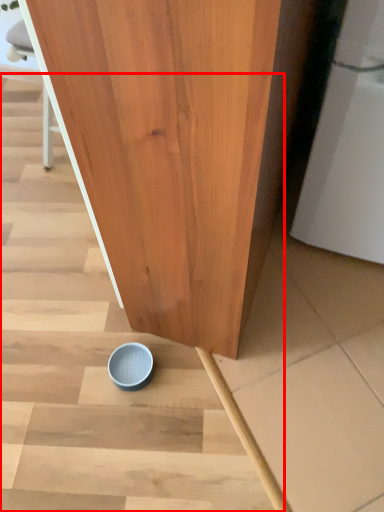
Question: Where is stairwell (annotated by the red box) located in relation to tableware in the image?

Choices:
 (A) right
 (B) left

Answer: (A)